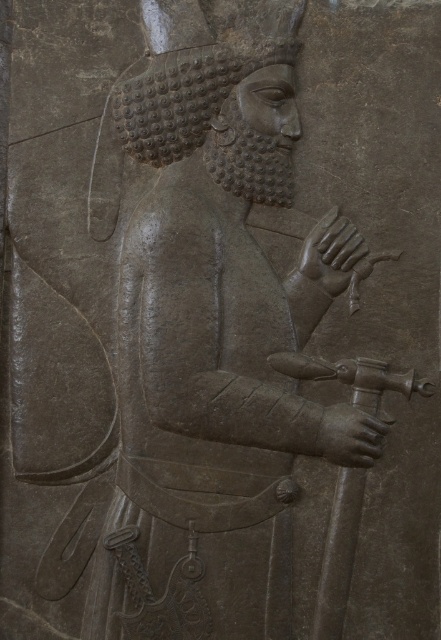
Does gray stone figure at center have a lesser height compared to smooth gray stone hand at center?

Incorrect, gray stone figure at center's height does not fall short of smooth gray stone hand at center's.

What do you see at coordinates (205, 358) in the screenshot? I see `gray stone figure at center` at bounding box center [205, 358].

I want to click on gray stone figure at center, so click(205, 358).

Between gray stone figure at center and polished bronze hand at center, which one appears on the right side from the viewer's perspective?

polished bronze hand at center is more to the right.

Does gray stone figure at center have a lesser height compared to polished bronze hand at center?

No.

Identify the location of gray stone figure at center. This screenshot has width=441, height=640. (205, 358).

Does point (336, 214) lie in front of point (355, 449)?

No, it is not.

Which of these two, smooth gray stone hand at center or polished bronze hand at center, stands taller?

Standing taller between the two is smooth gray stone hand at center.

Between point (342, 236) and point (381, 433), which one is positioned in front?

Point (381, 433) is more forward.

Find the location of a particular element. The width and height of the screenshot is (441, 640). smooth gray stone hand at center is located at coordinates (332, 252).